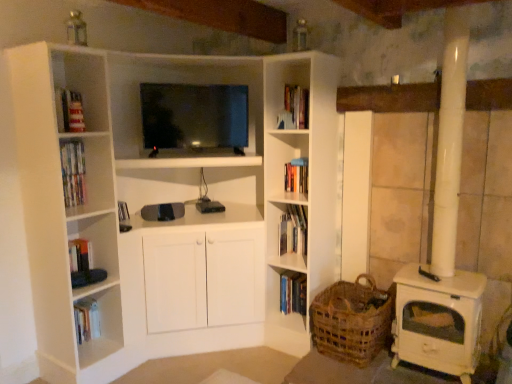
Question: From a real-world perspective, is woven brown basket at lower right physically located above or below hardcover book at center, which is the first book in bottom-to-top order?

Choices:
 (A) above
 (B) below

Answer: (A)

Question: Based on their positions, is woven brown basket at lower right located to the left or right of hardcover book at center, the 2th book in the top-to-bottom sequence?

Choices:
 (A) left
 (B) right

Answer: (B)

Question: Estimate the real-world distances between objects in this image. Which object is closer to the woven brown basket at lower right?

Choices:
 (A) matte black tv at center
 (B) hardcover book at center, the 2th book in the top-to-bottom sequence
 (C) hardcover book at center, which is counted as the 2th book, starting from the bottom

Answer: (B)

Question: Based on their relative distances, which object is nearer to the woven brown basket at lower right?

Choices:
 (A) hardcover book at center, the 2th book in the top-to-bottom sequence
 (B) hardcover book at center, which is counted as the 2th book, starting from the bottom
 (C) matte black tv at center

Answer: (A)